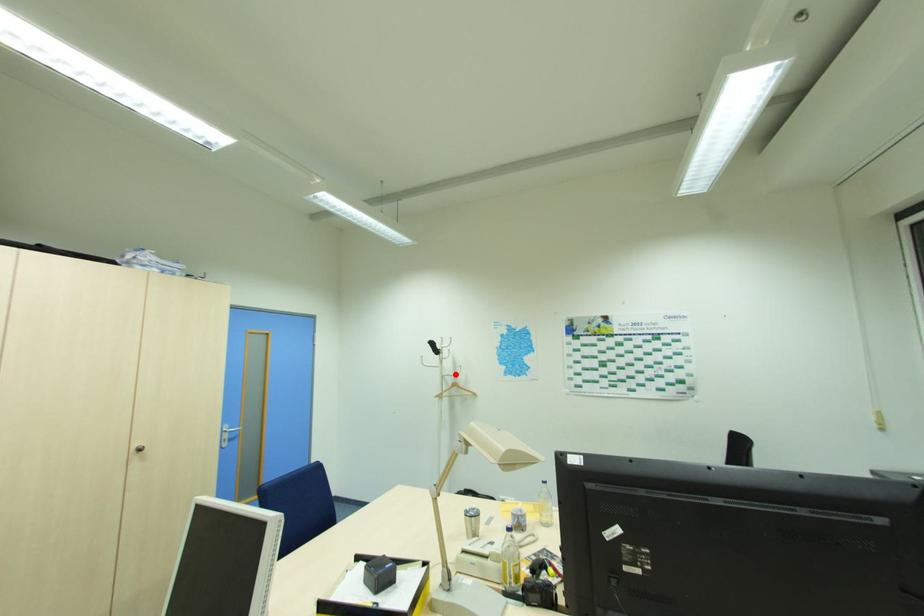
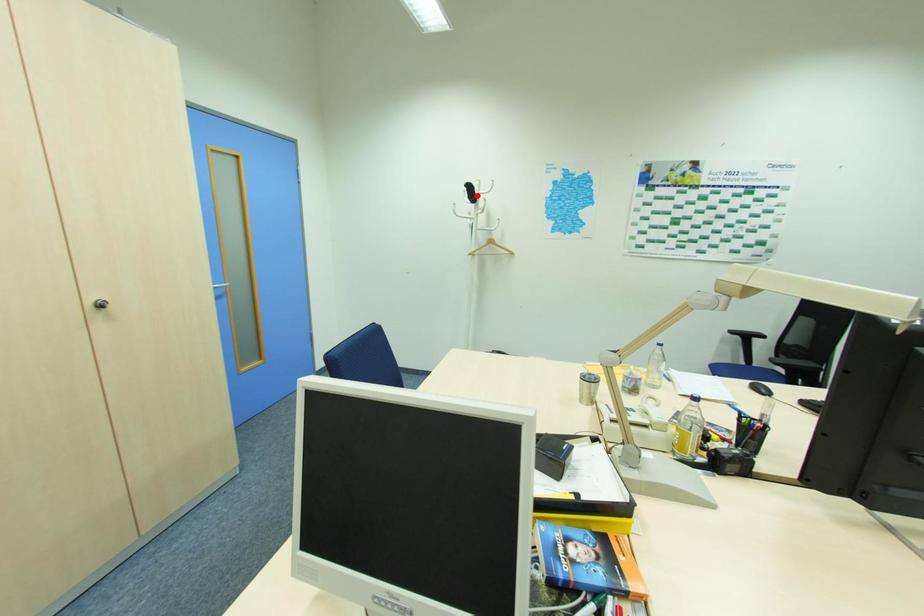
I am providing you with two images of the same scene from different viewpoints. A red point is marked on the first image and another point is marked on the second image. Do the highlighted points in image1 and image2 indicate the same real-world spot?

No